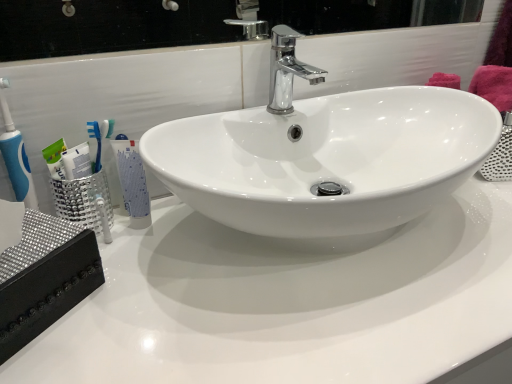
Question: Does chrome/metallic faucet at center appear on the right side of white glossy countertop at center?

Choices:
 (A) no
 (B) yes

Answer: (A)

Question: Is chrome/metallic faucet at center positioned in front of white glossy countertop at center?

Choices:
 (A) yes
 (B) no

Answer: (B)

Question: Is chrome/metallic faucet at center at the left side of white glossy countertop at center?

Choices:
 (A) yes
 (B) no

Answer: (A)

Question: From the image's perspective, does chrome/metallic faucet at center appear lower than white glossy countertop at center?

Choices:
 (A) no
 (B) yes

Answer: (A)

Question: Can you confirm if chrome/metallic faucet at center is shorter than white glossy countertop at center?

Choices:
 (A) no
 (B) yes

Answer: (B)

Question: Is chrome/metallic faucet at center far from white glossy countertop at center?

Choices:
 (A) yes
 (B) no

Answer: (B)

Question: Is chrome/metallic faucet at center to the left of white glossy tube at left from the viewer's perspective?

Choices:
 (A) yes
 (B) no

Answer: (B)

Question: Is chrome/metallic faucet at center further to the viewer compared to white glossy tube at left?

Choices:
 (A) yes
 (B) no

Answer: (B)

Question: Is there a large distance between chrome/metallic faucet at center and white glossy tube at left?

Choices:
 (A) yes
 (B) no

Answer: (B)

Question: From the image's perspective, is chrome/metallic faucet at center located beneath white glossy tube at left?

Choices:
 (A) no
 (B) yes

Answer: (A)

Question: Is chrome/metallic faucet at center in front of white glossy tube at left?

Choices:
 (A) no
 (B) yes

Answer: (B)

Question: Are chrome/metallic faucet at center and white glossy tube at left making contact?

Choices:
 (A) no
 (B) yes

Answer: (A)

Question: Is white glossy tube at left closer to camera compared to chrome/metallic faucet at center?

Choices:
 (A) no
 (B) yes

Answer: (A)